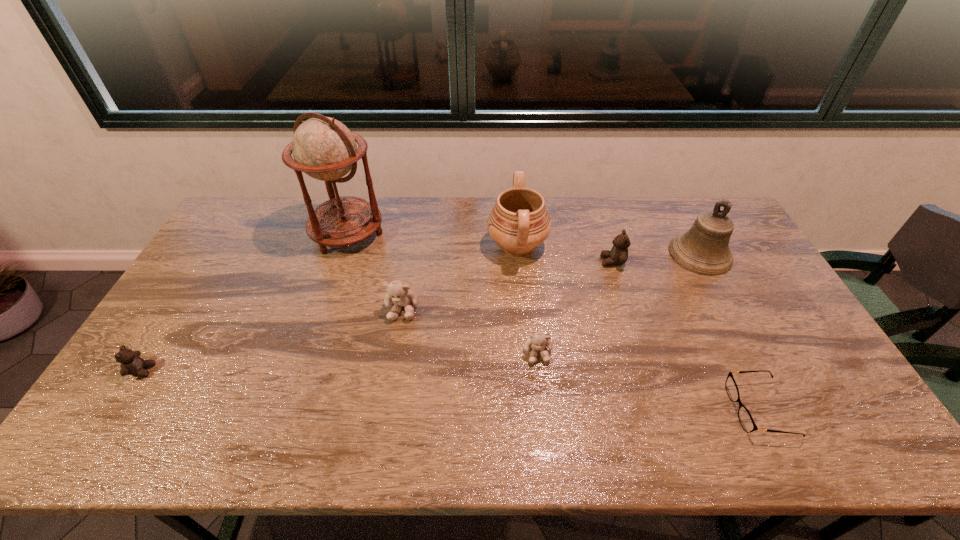
Where is `the right gray teddy bear`? The width and height of the screenshot is (960, 540). the right gray teddy bear is located at coordinates (538, 341).

This screenshot has height=540, width=960. Identify the location of the nearer gray teddy bear. (538, 341).

This screenshot has width=960, height=540. Find the location of `the shortest object`. the shortest object is located at coordinates (745, 418).

At what (x,y) coordinates should I click in order to perform the action: click on free location located on the surface of the tallest object. Please return your answer as a coordinate pair (x, y). Image resolution: width=960 pixels, height=540 pixels. Looking at the image, I should click on (331, 285).

This screenshot has height=540, width=960. What are the coordinates of `vacant space located 0.370m on the front-facing side of the urn` in the screenshot? It's located at (378, 246).

Identify the location of free space located on the front-facing side of the urn. (448, 246).

Where is `free space located on the front-facing side of the urn`? The image size is (960, 540). free space located on the front-facing side of the urn is located at coordinates (422, 246).

Locate an element on the screen. This screenshot has height=540, width=960. vacant space situated 0.260m on the front of the bell is located at coordinates [x=746, y=342].

Identify the location of free spot located on the face of the farthest teddy bear. Image resolution: width=960 pixels, height=540 pixels. (545, 261).

Find the location of `free region located on the face of the farthest teddy bear`. free region located on the face of the farthest teddy bear is located at coordinates (582, 261).